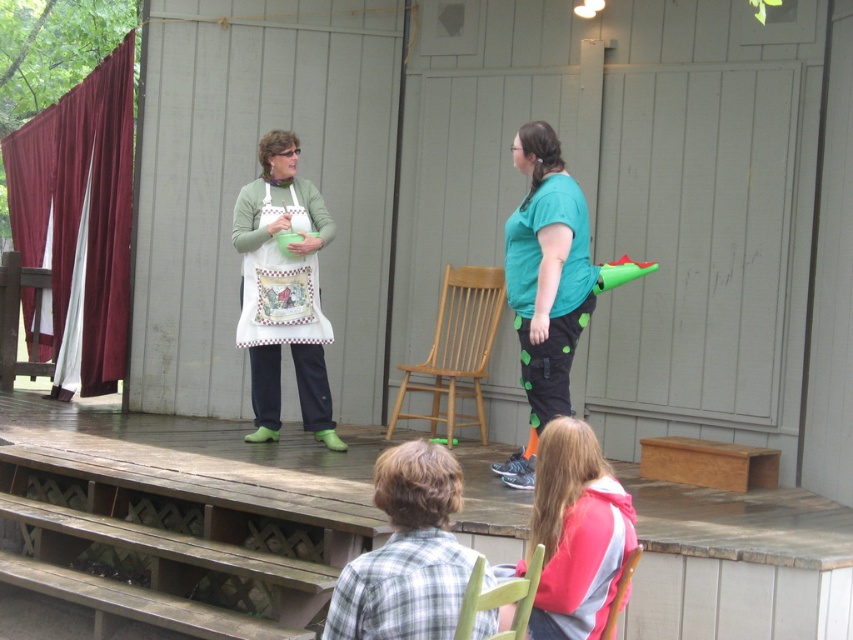
Is point (395, 467) farther from camera compared to point (621, 580)?

No, (395, 467) is closer to viewer.

Who is shorter, plaid shirt at lower center or wooden chair at lower center?

Standing shorter between the two is wooden chair at lower center.

Measure the distance between plaid shirt at lower center and camera.

A distance of 3.26 meters exists between plaid shirt at lower center and camera.

The width and height of the screenshot is (853, 640). I want to click on plaid shirt at lower center, so click(405, 554).

Which is below, white apron at center or pink fleece jacket at lower center?

pink fleece jacket at lower center is lower down.

Does white apron at center have a larger size compared to pink fleece jacket at lower center?

Indeed, white apron at center has a larger size compared to pink fleece jacket at lower center.

Who is more forward, (302, 384) or (552, 438)?

Point (552, 438)

Identify the location of white apron at center. The height and width of the screenshot is (640, 853). (267, 289).

Between wooden stage at center and wooden chair at lower center, which one has less height?

With less height is wooden chair at lower center.

Is wooden stage at center in front of wooden chair at lower center?

No, wooden stage at center is further to the viewer.

Between point (792, 550) and point (611, 605), which one is positioned in front?

Point (611, 605) is in front.

The width and height of the screenshot is (853, 640). Find the location of `wooden stage at center`. wooden stage at center is located at coordinates (180, 516).